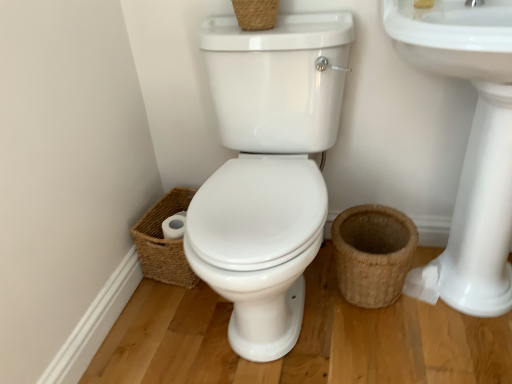
The width and height of the screenshot is (512, 384). In order to click on vacant space positioned to the left of brown woven basket at lower right, the first basket from the right in this screenshot , I will do `click(310, 314)`.